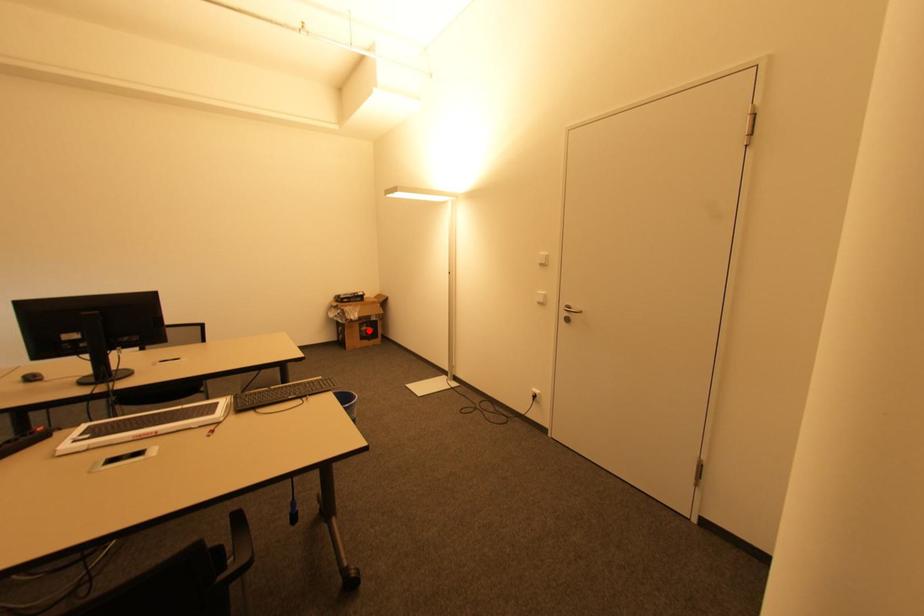
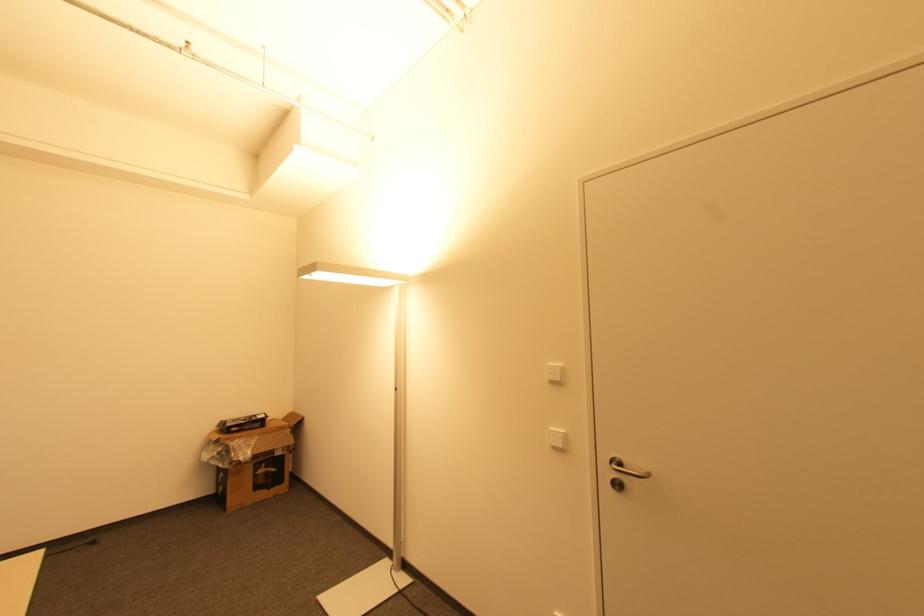
Where in the second image is the point corresponding to the highlighted location from the first image?

(268, 472)